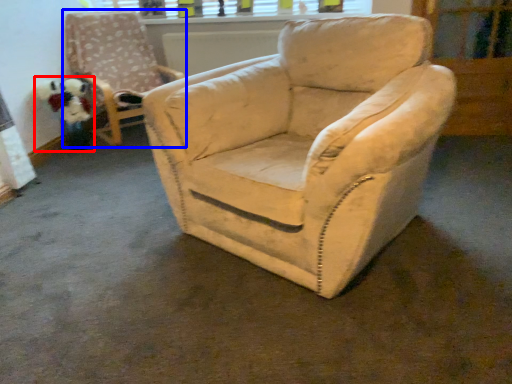
Question: Which object is closer to the camera taking this photo, toy (highlighted by a red box) or chair (highlighted by a blue box)?

Choices:
 (A) toy
 (B) chair

Answer: (B)